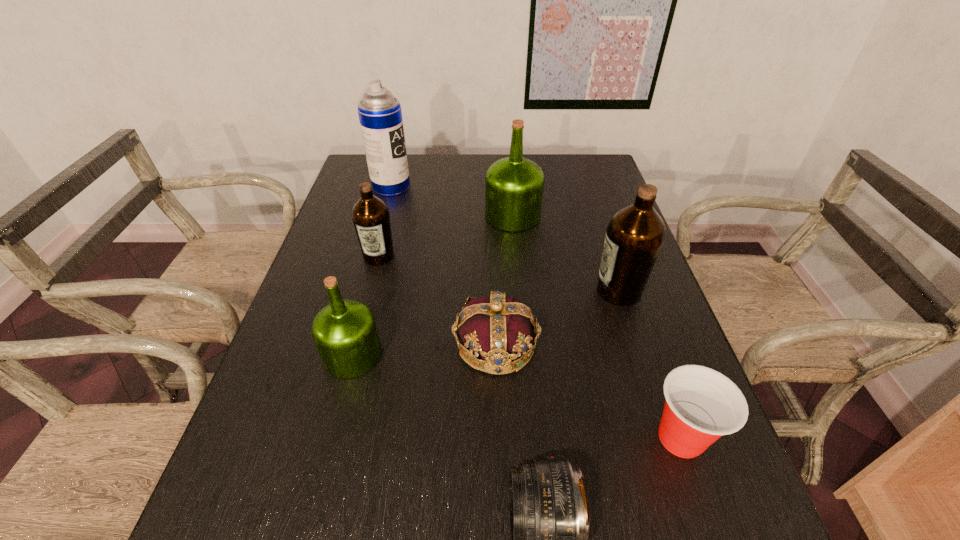
Where is `blue aerosol can`? The image size is (960, 540). blue aerosol can is located at coordinates (380, 115).

Identify the location of the farthest object. This screenshot has height=540, width=960. tap(380, 115).

Where is `the farthest olive oil`? The width and height of the screenshot is (960, 540). the farthest olive oil is located at coordinates (514, 186).

Locate an element on the screen. The image size is (960, 540). the right green olive oil is located at coordinates (514, 186).

You are a GUI agent. You are given a task and a screenshot of the screen. Output one action in this format:
    pyautogui.click(x=<x>, y=<y>)
    Task: Click on the bigger brown olive oil
    The height and width of the screenshot is (540, 960).
    Given the screenshot: What is the action you would take?
    pyautogui.click(x=634, y=237)

Find the location of a particular element. The height and width of the screenshot is (540, 960). the fourth farthest object is located at coordinates (634, 237).

You are a GUI agent. You are given a task and a screenshot of the screen. Output one action in this format:
    pyautogui.click(x=<x>, y=<y>)
    Task: Click on the second farthest olive oil
    The width and height of the screenshot is (960, 540).
    Given the screenshot: What is the action you would take?
    pyautogui.click(x=370, y=215)

You are a GUI agent. You are given a task and a screenshot of the screen. Output one action in this format:
    pyautogui.click(x=<x>, y=<y>)
    Task: Click on the farther brown olive oil
    The image size is (960, 540).
    Given the screenshot: What is the action you would take?
    pyautogui.click(x=370, y=215)

This screenshot has width=960, height=540. What are the coordinates of `the nearer green olive oil` in the screenshot? It's located at (345, 332).

At what (x,y) coordinates should I click in order to perform the action: click on the smaller green olive oil. Please return your answer as a coordinate pair (x, y). Looking at the image, I should click on click(x=345, y=332).